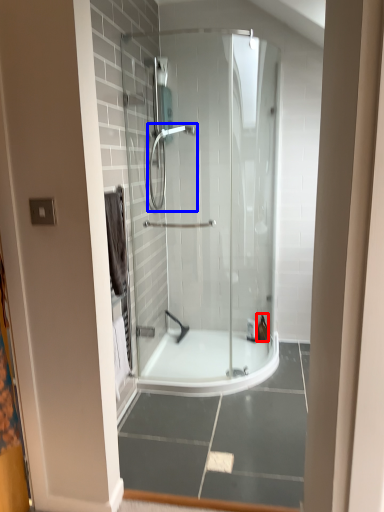
Question: Among these objects, which one is nearest to the camera, toiletry (highlighted by a red box) or shower (highlighted by a blue box)?

Choices:
 (A) toiletry
 (B) shower

Answer: (B)